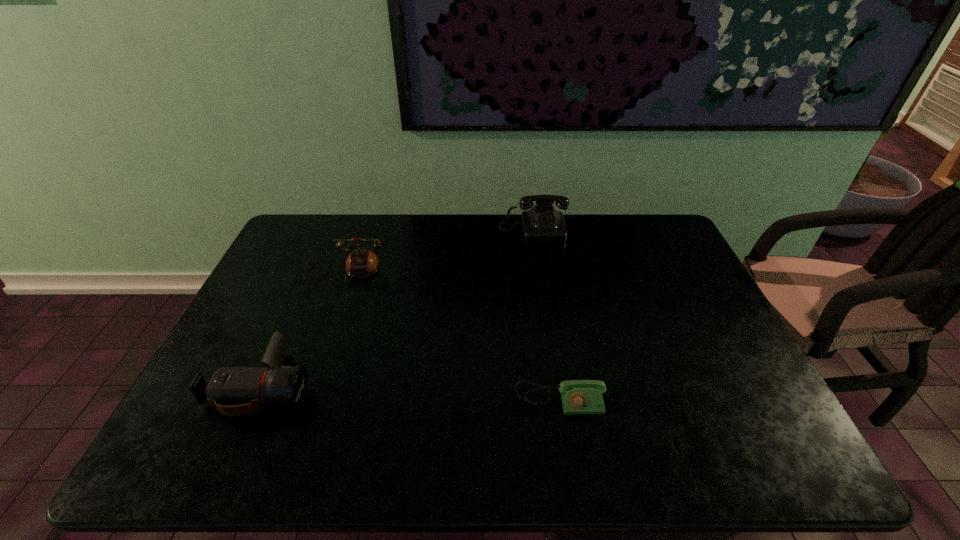
Where is `object that is at the far edge`? Image resolution: width=960 pixels, height=540 pixels. object that is at the far edge is located at coordinates (542, 223).

You are a GUI agent. You are given a task and a screenshot of the screen. Output one action in this format:
    pyautogui.click(x=<x>, y=<y>)
    Task: Click on the telephone that is at the left edge
    
    Given the screenshot: What is the action you would take?
    pyautogui.click(x=361, y=262)

Locate an element on the screen. The width and height of the screenshot is (960, 540). camcorder that is at the left edge is located at coordinates (235, 391).

The height and width of the screenshot is (540, 960). In the image, there is a desktop. What are the coordinates of `free space at the far edge` in the screenshot? It's located at (416, 240).

In the image, there is a desktop. Find the location of `free region at the left edge`. free region at the left edge is located at coordinates pos(291,328).

The image size is (960, 540). Identify the location of vacant space at the right edge of the desktop. (652, 285).

Where is `vacant area at the far right corner of the desktop`? vacant area at the far right corner of the desktop is located at coordinates (648, 219).

The image size is (960, 540). Identify the location of vacant space that's between the third tallest object and the shortest telephone. (411, 393).

Locate an element on the screen. vacant area that lies between the second farthest telephone and the shortest telephone is located at coordinates (450, 335).

Identify the location of empty space between the third nearest object and the second shortest object. (301, 328).